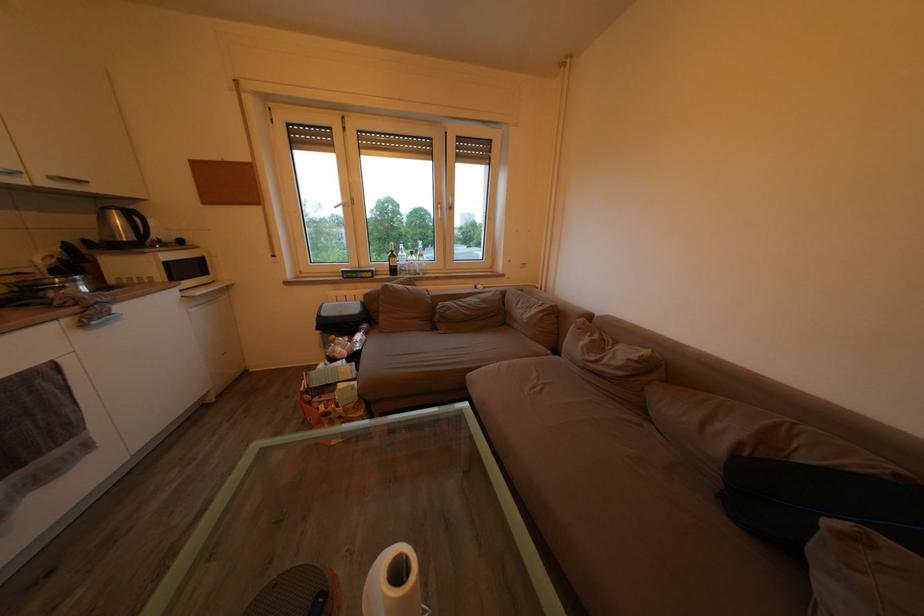
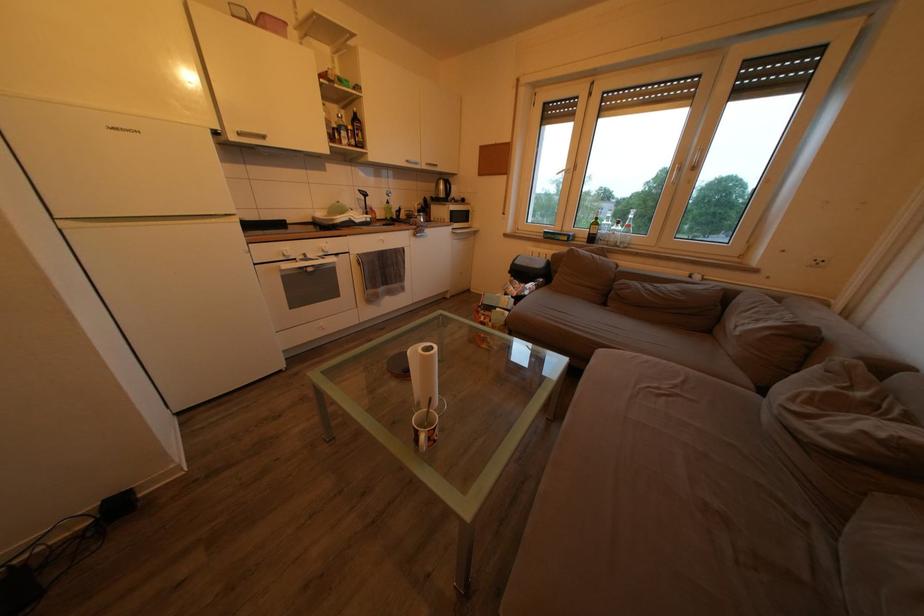
Question: The images are taken continuously from a first-person perspective. In which direction is your viewpoint rotating?

Choices:
 (A) Left
 (B) Right
 (C) Up
 (D) Down

Answer: (A)